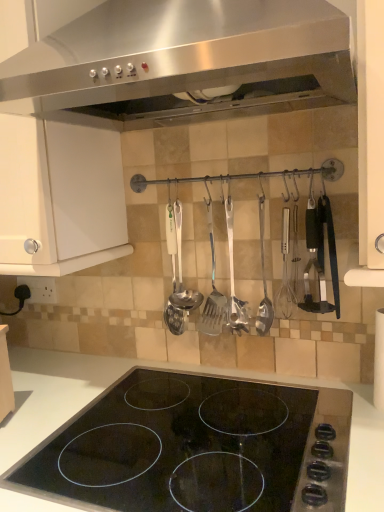
Question: Can you confirm if metallic silver ladle at center is smaller than polished metal ladle at center, marked as the first silverware in a right-to-left arrangement?

Choices:
 (A) no
 (B) yes

Answer: (A)

Question: Does metallic silver ladle at center have a greater height compared to polished metal ladle at center, positioned as the 4th silverware in left-to-right order?

Choices:
 (A) no
 (B) yes

Answer: (A)

Question: Is metallic silver ladle at center oriented away from polished metal ladle at center, positioned as the 4th silverware in left-to-right order?

Choices:
 (A) yes
 (B) no

Answer: (B)

Question: Does metallic silver ladle at center have a greater width compared to polished metal ladle at center, positioned as the 4th silverware in left-to-right order?

Choices:
 (A) yes
 (B) no

Answer: (A)

Question: Can you confirm if metallic silver ladle at center is positioned to the right of polished metal ladle at center, marked as the first silverware in a right-to-left arrangement?

Choices:
 (A) no
 (B) yes

Answer: (A)

Question: Does metallic silver ladle at center lie behind polished metal ladle at center, positioned as the 4th silverware in left-to-right order?

Choices:
 (A) yes
 (B) no

Answer: (A)

Question: Could you tell me if metallic silver ladle at center is turned towards polished stainless steel spatula at center, placed as the 2th silverware when sorted from right to left?

Choices:
 (A) no
 (B) yes

Answer: (A)

Question: Does metallic silver ladle at center have a lesser height compared to polished stainless steel spatula at center, placed as the 2th silverware when sorted from right to left?

Choices:
 (A) yes
 (B) no

Answer: (A)

Question: Considering the relative sizes of metallic silver ladle at center and polished stainless steel spatula at center, placed as the 2th silverware when sorted from right to left, in the image provided, is metallic silver ladle at center smaller than polished stainless steel spatula at center, placed as the 2th silverware when sorted from right to left,?

Choices:
 (A) yes
 (B) no

Answer: (A)

Question: Considering the relative sizes of metallic silver ladle at center and polished stainless steel spatula at center, marked as the 3th silverware in a left-to-right arrangement, in the image provided, is metallic silver ladle at center taller than polished stainless steel spatula at center, marked as the 3th silverware in a left-to-right arrangement,?

Choices:
 (A) yes
 (B) no

Answer: (B)

Question: Can you confirm if metallic silver ladle at center is wider than polished stainless steel spatula at center, marked as the 3th silverware in a left-to-right arrangement?

Choices:
 (A) no
 (B) yes

Answer: (B)

Question: Can you confirm if metallic silver ladle at center is positioned to the left of polished stainless steel spatula at center, placed as the 2th silverware when sorted from right to left?

Choices:
 (A) no
 (B) yes

Answer: (B)

Question: From a real-world perspective, does white matte cabinet at upper left stand above polished stainless steel ladle at center, the 4th silverware viewed from the right?

Choices:
 (A) yes
 (B) no

Answer: (A)